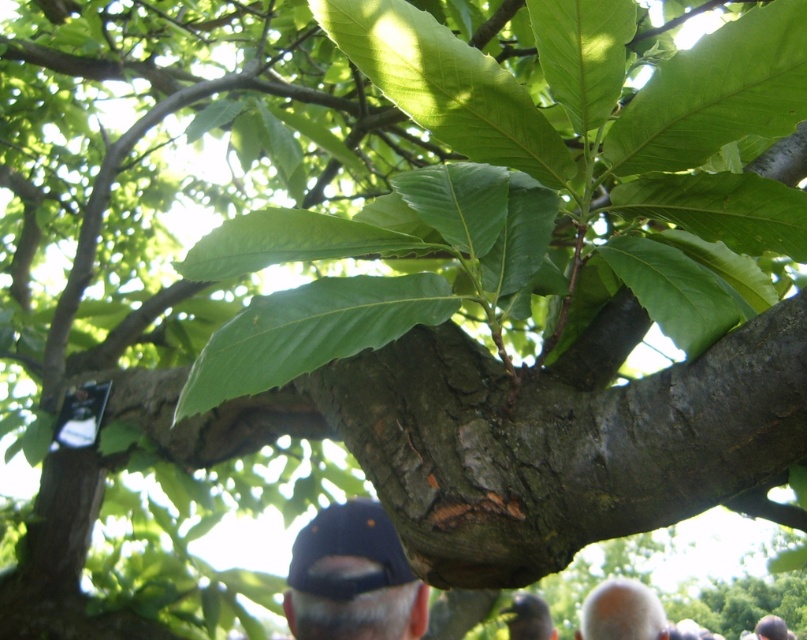
Question: Which is farther from the gray matte cap at upper center?

Choices:
 (A) bald head at lower right
 (B) dark blue fabric baseball cap at lower center

Answer: (B)

Question: Does bald head at lower right have a smaller size compared to gray matte cap at upper center?

Choices:
 (A) no
 (B) yes

Answer: (A)

Question: Is bald head at lower right closer to camera compared to gray matte cap at upper center?

Choices:
 (A) no
 (B) yes

Answer: (A)

Question: Which of the following is the closest to the observer?

Choices:
 (A) dark blue fabric baseball cap at lower center
 (B) gray matte cap at upper center

Answer: (A)

Question: Which point is farther from the camera taking this photo?

Choices:
 (A) (650, 604)
 (B) (320, 588)

Answer: (A)

Question: Is bald head at lower right to the left of gray matte cap at upper center from the viewer's perspective?

Choices:
 (A) no
 (B) yes

Answer: (A)